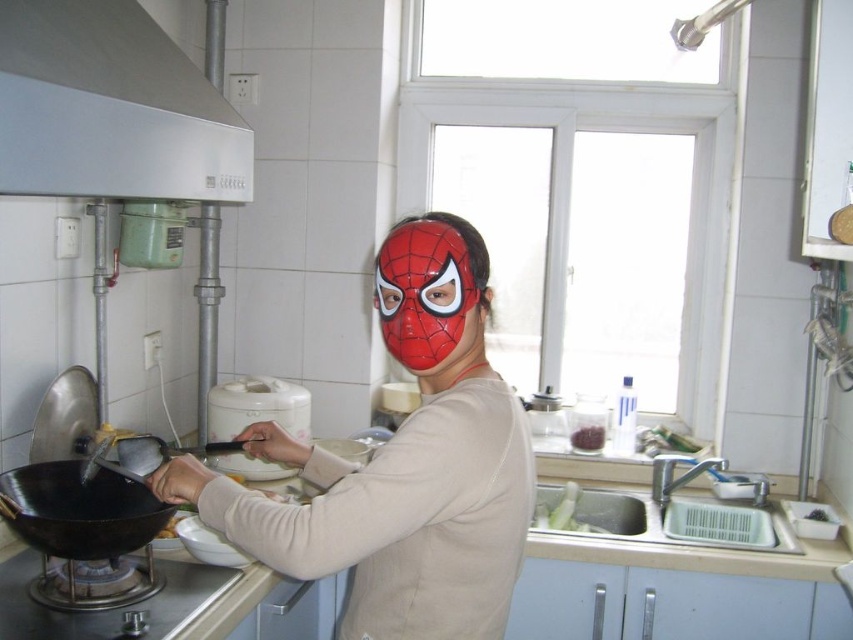
You are a photographer standing in the kitchen and want to take a closeup photo of the red matte mask at center. If your camera has a minimum focusing distance of 4 feet, will you be able to take the photo without moving closer?

The red matte mask at center is 3.83 feet away from the camera, which is within the minimum focusing distance of 4 feet. Therefore, you can take the photo without moving closer.

You are a drone operator trying to capture a closeup shot of the white glossy exhaust hood at upper left from the camera position. The drone can only move forward or backward. What should you do to get closer to the exhaust hood?

The distance between the white glossy exhaust hood at upper left and the camera is 3.50 feet. To get closer, the drone should move forward by less than 3.50 feet.

Looking at this image, you are a guest in this kitchen and need to wash your hands. The sink is near the brown crumbly food at sink. Where should you go first to reach the faucet, considering the red matte mask at center is blocking the path?

The red matte mask at center is in front of the brown crumbly food at sink, so you should move around the mask to access the faucet near the sink.